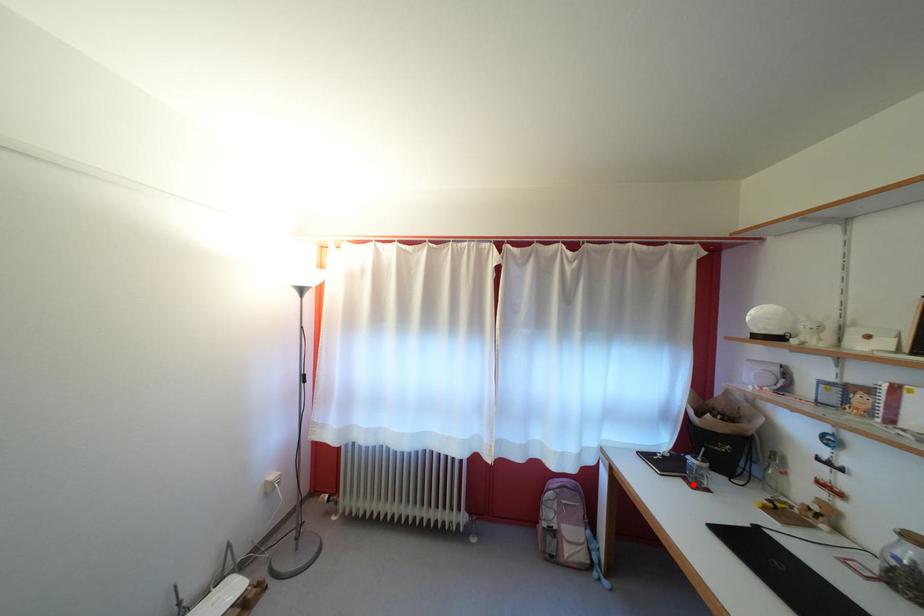
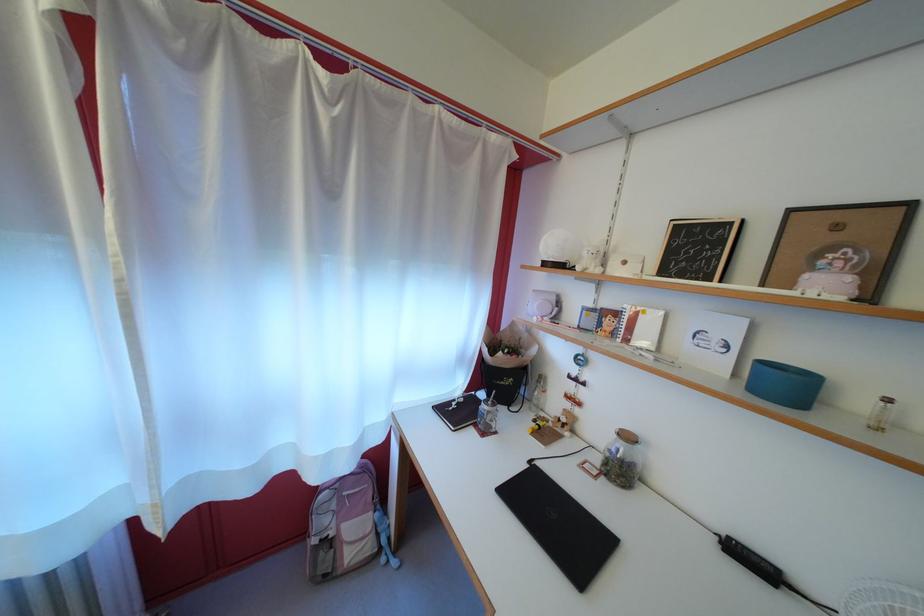
Locate, in the second image, the point that corresponds to the highlighted location in the first image.

(483, 431)